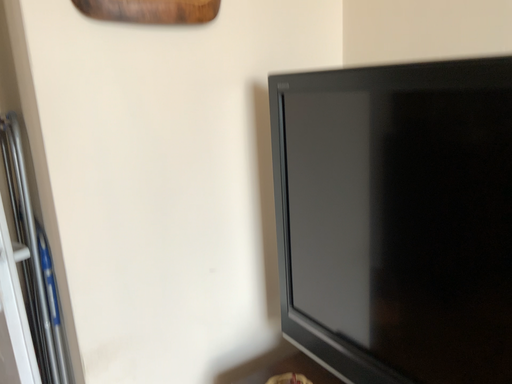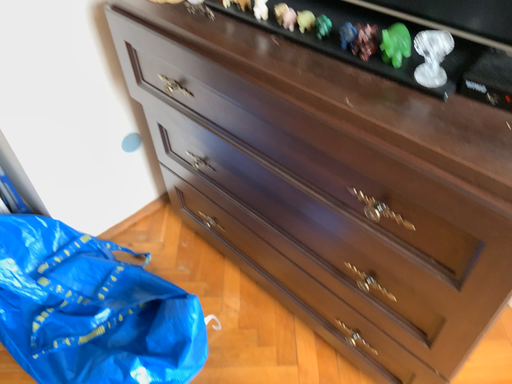
Question: Which way did the camera rotate in the video?

Choices:
 (A) rotated right
 (B) rotated left

Answer: (A)